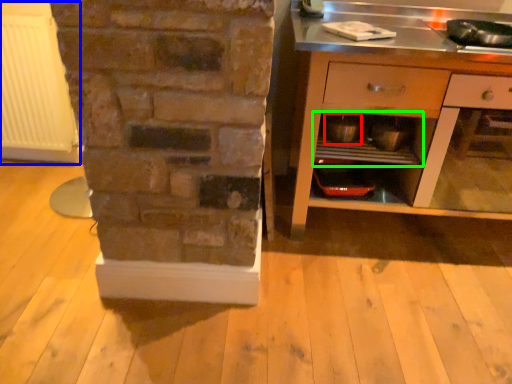
Question: Considering the real-world distances, which object is farthest from appliance (highlighted by a red box)? radiator (highlighted by a blue box) or shelf (highlighted by a green box)?

Choices:
 (A) radiator
 (B) shelf

Answer: (A)